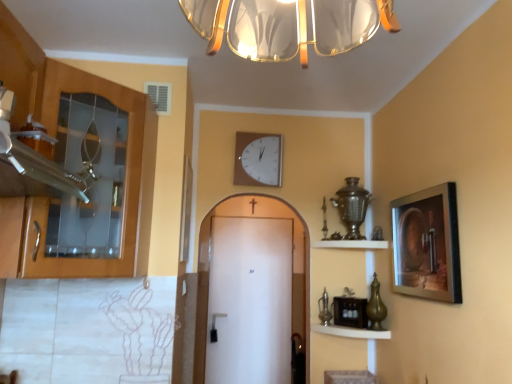
What do you see at coordinates (258, 159) in the screenshot? I see `white plastic wall clock at upper center` at bounding box center [258, 159].

Measure the distance between metallic silver picture frame at right and camera.

5.39 feet.

Where is `white matte door at center`? The height and width of the screenshot is (384, 512). white matte door at center is located at coordinates (208, 267).

Locate an element on the screen. This screenshot has width=512, height=384. metallic gold shelf at upper center, the 2th shelf when ordered from bottom to top is located at coordinates 352,244.

From the picture: Is white plastic wall clock at upper center inside the boundaries of wooden shelf at lower center, which is the 2th shelf in top-to-bottom order, or outside?

white plastic wall clock at upper center is spatially situated outside wooden shelf at lower center, which is the 2th shelf in top-to-bottom order.

Is white plastic wall clock at upper center placed right next to wooden shelf at lower center, which is the 2th shelf in top-to-bottom order?

white plastic wall clock at upper center is not next to wooden shelf at lower center, which is the 2th shelf in top-to-bottom order, and they're not touching.

In terms of width, does white plastic wall clock at upper center look wider or thinner when compared to wooden shelf at lower center, which is the 2th shelf in top-to-bottom order?

white plastic wall clock at upper center is thinner than wooden shelf at lower center, which is the 2th shelf in top-to-bottom order.

From the image's perspective, is white plastic wall clock at upper center below wooden shelf at lower center, the 1th shelf from the bottom?

No, from the image's perspective, white plastic wall clock at upper center is not below wooden shelf at lower center, the 1th shelf from the bottom.

Is metallic silver picture frame at right not inside metallic gold shelf at upper center, the 2th shelf when ordered from bottom to top?

Yes, metallic silver picture frame at right is located beyond the bounds of metallic gold shelf at upper center, the 2th shelf when ordered from bottom to top.

Is there a large distance between metallic silver picture frame at right and metallic gold shelf at upper center, which is the first shelf from top to bottom?

No, metallic silver picture frame at right is in close proximity to metallic gold shelf at upper center, which is the first shelf from top to bottom.

Consider the image. Is metallic gold shelf at upper center, the 2th shelf when ordered from bottom to top, at the back of metallic silver picture frame at right?

No.

Does wooden shelf at lower center, the 1th shelf from the bottom, have a greater height compared to metallic gold shelf at upper center, which is the first shelf from top to bottom?

No.

Is wooden shelf at lower center, the 1th shelf from the bottom, oriented towards metallic gold shelf at upper center, which is the first shelf from top to bottom?

No, wooden shelf at lower center, the 1th shelf from the bottom, is not turned towards metallic gold shelf at upper center, which is the first shelf from top to bottom.

From a real-world perspective, does wooden shelf at lower center, the 1th shelf from the bottom, sit lower than metallic gold shelf at upper center, the 2th shelf when ordered from bottom to top?

Yes.

Looking at this image, does wooden shelf at lower center, which is the 2th shelf in top-to-bottom order, appear on the left side of metallic gold shelf at upper center, which is the first shelf from top to bottom?

Correct, you'll find wooden shelf at lower center, which is the 2th shelf in top-to-bottom order, to the left of metallic gold shelf at upper center, which is the first shelf from top to bottom.

Considering the sizes of metallic silver picture frame at right and wooden shelf at lower center, which is the 2th shelf in top-to-bottom order, in the image, is metallic silver picture frame at right taller or shorter than wooden shelf at lower center, which is the 2th shelf in top-to-bottom order,?

metallic silver picture frame at right is taller than wooden shelf at lower center, which is the 2th shelf in top-to-bottom order.

The height and width of the screenshot is (384, 512). Identify the location of the 2nd shelf counting from the left side of the metallic silver picture frame at right. (351, 332).

Who is more distant, metallic silver picture frame at right or wooden shelf at lower center, the 1th shelf from the bottom?

wooden shelf at lower center, the 1th shelf from the bottom.

In order to click on door below the wooden shelf at lower center, the 1th shelf from the bottom (from the image's perspective) in this screenshot , I will do `click(208, 267)`.

Is wooden shelf at lower center, the 1th shelf from the bottom, facing towards white matte door at center?

No, wooden shelf at lower center, the 1th shelf from the bottom, does not turn towards white matte door at center.

Considering the sizes of objects wooden shelf at lower center, which is the 2th shelf in top-to-bottom order, and white matte door at center in the image provided, who is taller, wooden shelf at lower center, which is the 2th shelf in top-to-bottom order, or white matte door at center?

Standing taller between the two is white matte door at center.

Looking at the image, does wooden cabinet at left seem bigger or smaller compared to metallic silver picture frame at right?

Considering their sizes, wooden cabinet at left takes up more space than metallic silver picture frame at right.

From a real-world perspective, does wooden cabinet at left stand above metallic silver picture frame at right?

Indeed, from a real-world perspective, wooden cabinet at left stands above metallic silver picture frame at right.

Consider the image. Is wooden cabinet at left surrounding metallic silver picture frame at right?

No, metallic silver picture frame at right is not inside wooden cabinet at left.

Is wooden cabinet at left not near white matte door at center?

Yes, wooden cabinet at left and white matte door at center are quite far apart.

Is wooden cabinet at left taller than white matte door at center?

Incorrect, the height of wooden cabinet at left is not larger of that of white matte door at center.

Is wooden cabinet at left facing away from white matte door at center?

That's not correct — wooden cabinet at left is not looking away from white matte door at center.

From the image's perspective, count 2nd shelfs downward from the white plastic wall clock at upper center and point to it. Please provide its 2D coordinates.

[(351, 332)]

Identify the location of shelf above the metallic silver picture frame at right (from a real-world perspective). (352, 244).

Estimate the real-world distances between objects in this image. Which object is further from white plastic wall clock at upper center, metallic silver picture frame at right or wooden shelf at lower center, the 1th shelf from the bottom?

wooden shelf at lower center, the 1th shelf from the bottom.

Looking at this image, looking at the image, which one is located closer to wooden shelf at lower center, which is the 2th shelf in top-to-bottom order, metallic gold shelf at upper center, which is the first shelf from top to bottom, or wooden cabinet at left?

metallic gold shelf at upper center, which is the first shelf from top to bottom, is closer to wooden shelf at lower center, which is the 2th shelf in top-to-bottom order.

Considering their positions, is metallic gold shelf at upper center, the 2th shelf when ordered from bottom to top, positioned closer to white plastic wall clock at upper center than metallic silver picture frame at right?

metallic gold shelf at upper center, the 2th shelf when ordered from bottom to top, is positioned closer to the anchor white plastic wall clock at upper center.

When comparing their distances from wooden cabinet at left, does white matte door at center or wooden shelf at lower center, the 1th shelf from the bottom, seem further?

Among the two, white matte door at center is located further to wooden cabinet at left.

Looking at the image, which one is located further to metallic silver picture frame at right, metallic gold shelf at upper center, the 2th shelf when ordered from bottom to top, or white plastic wall clock at upper center?

white plastic wall clock at upper center.

When comparing their distances from white matte door at center, does white plastic wall clock at upper center or wooden shelf at lower center, the 1th shelf from the bottom, seem further?

Based on the image, wooden shelf at lower center, the 1th shelf from the bottom, appears to be further to white matte door at center.

Based on their spatial positions, is metallic gold shelf at upper center, the 2th shelf when ordered from bottom to top, or wooden cabinet at left closer to white plastic wall clock at upper center?

metallic gold shelf at upper center, the 2th shelf when ordered from bottom to top, lies closer to white plastic wall clock at upper center than the other object.

From the picture: When comparing their distances from wooden cabinet at left, does wooden shelf at lower center, the 1th shelf from the bottom, or metallic silver picture frame at right seem further?

wooden shelf at lower center, the 1th shelf from the bottom, is further to wooden cabinet at left.

Where is `wall clock between metallic gold shelf at upper center, the 2th shelf when ordered from bottom to top, and white matte door at center, along the z-axis`? wall clock between metallic gold shelf at upper center, the 2th shelf when ordered from bottom to top, and white matte door at center, along the z-axis is located at coordinates (258, 159).

At what (x,y) coordinates should I click in order to perform the action: click on picture frame between white plastic wall clock at upper center and wooden shelf at lower center, which is the 2th shelf in top-to-bottom order, vertically. Please return your answer as a coordinate pair (x, y). The image size is (512, 384). Looking at the image, I should click on (426, 244).

You are a GUI agent. You are given a task and a screenshot of the screen. Output one action in this format:
    pyautogui.click(x=<x>, y=<y>)
    Task: Click on the wall clock between wooden cabinet at left and white matte door at center from front to back
    This screenshot has height=384, width=512.
    Given the screenshot: What is the action you would take?
    pyautogui.click(x=258, y=159)

You are a GUI agent. You are given a task and a screenshot of the screen. Output one action in this format:
    pyautogui.click(x=<x>, y=<y>)
    Task: Click on the shelf between metallic silver picture frame at right and metallic gold shelf at upper center, which is the first shelf from top to bottom, along the z-axis
    The width and height of the screenshot is (512, 384).
    Given the screenshot: What is the action you would take?
    pyautogui.click(x=351, y=332)